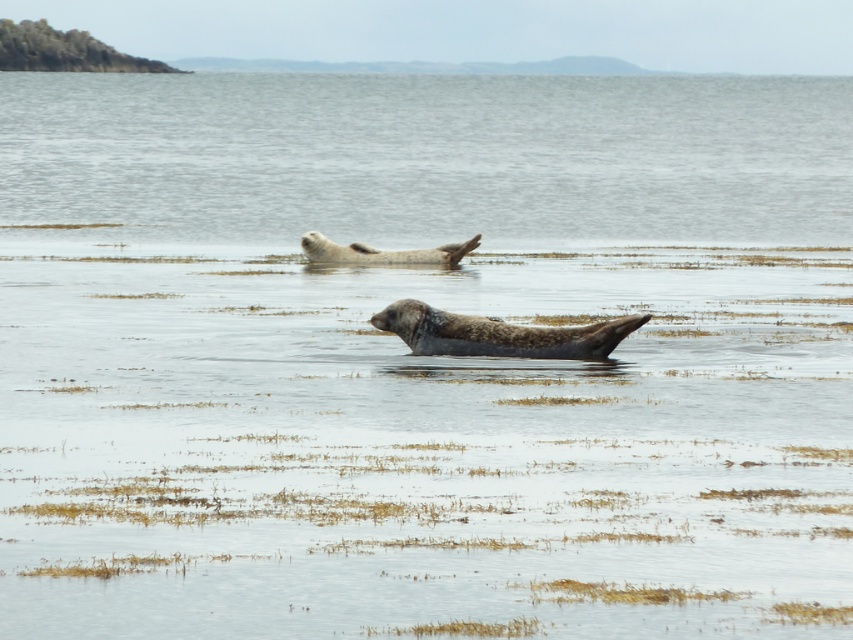
Is the position of speckled fur seal at center less distant than that of gray fur seal at center?

That is True.

Consider the image. Can you confirm if speckled fur seal at center is bigger than gray fur seal at center?

Yes, speckled fur seal at center is bigger than gray fur seal at center.

The height and width of the screenshot is (640, 853). What are the coordinates of `speckled fur seal at center` in the screenshot? It's located at (497, 333).